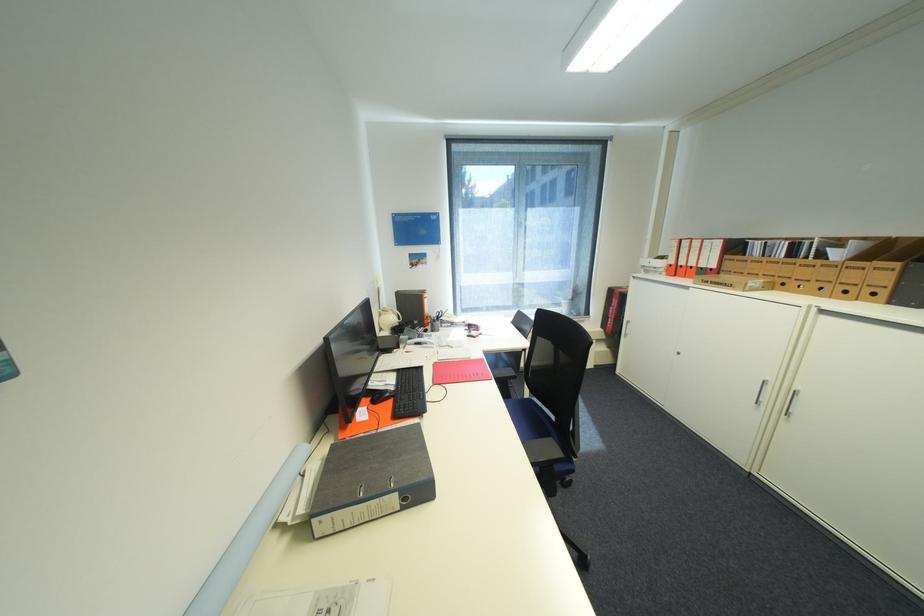
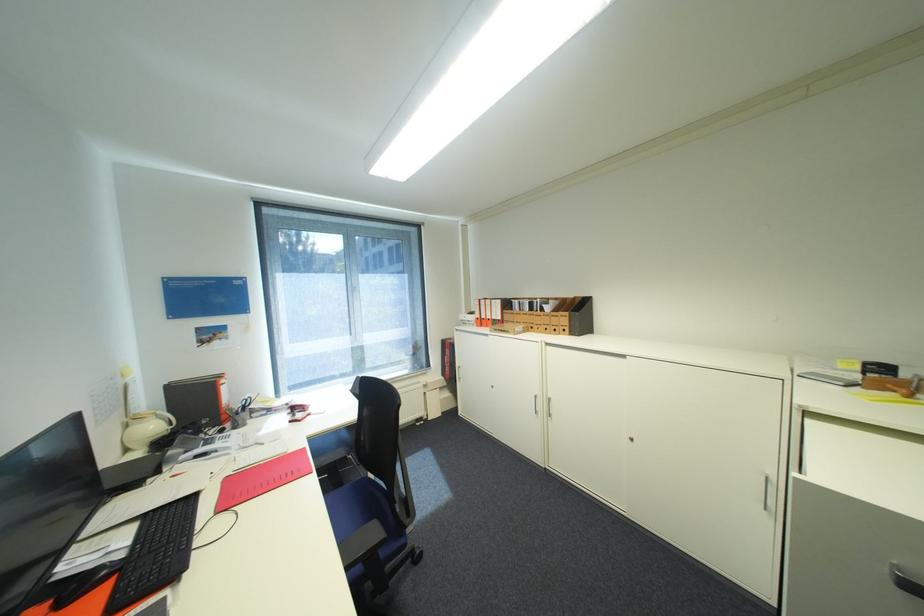
In the second image, find the point that corresponds to (442,315) in the first image.

(246, 406)